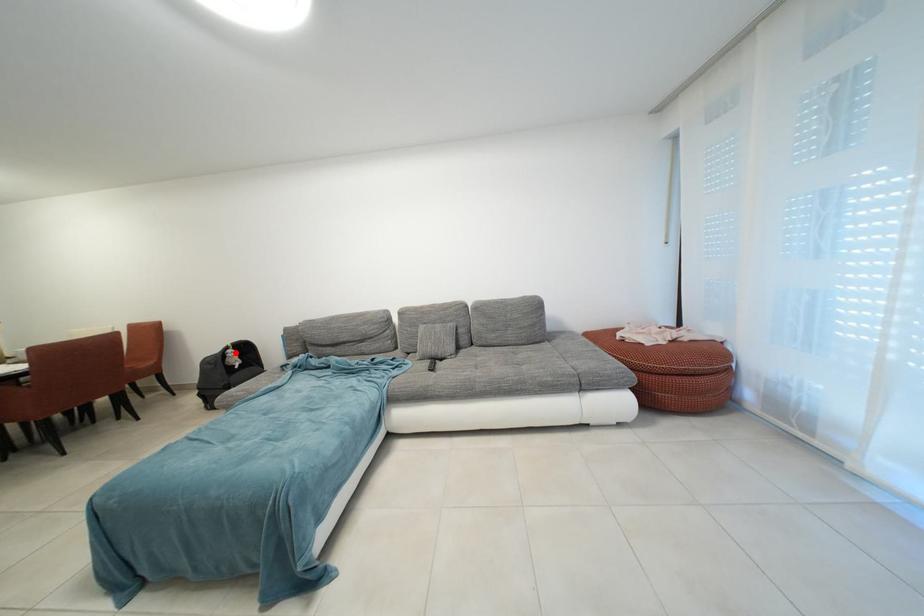
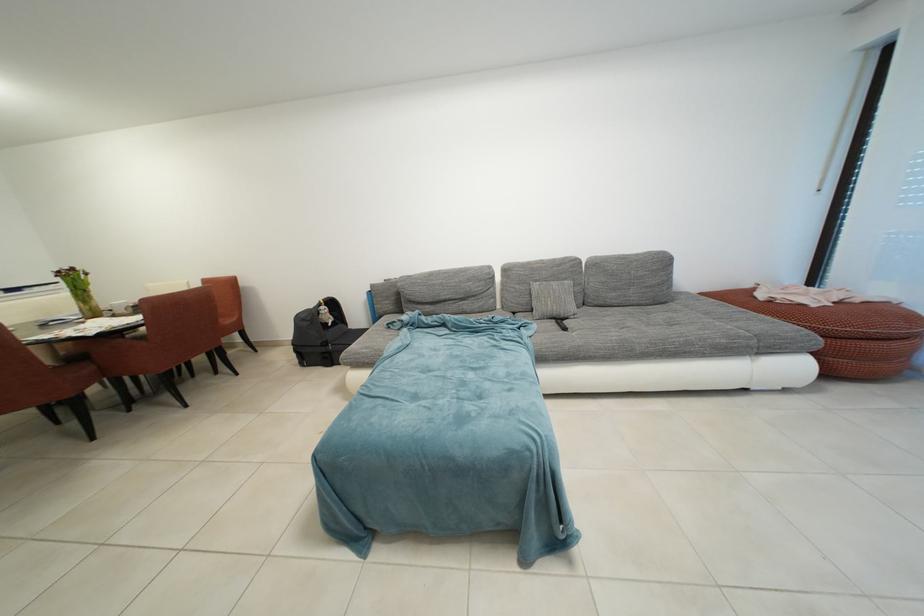
Find the pixel in the second image that matches the highlighted location in the first image.

(329, 309)